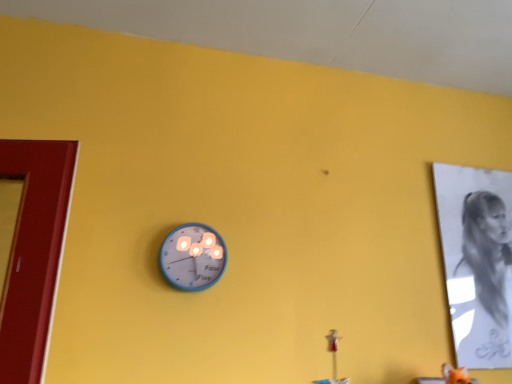
Question: Is blue metallic wall clock at center turned away from charcoal sketch of person at right?

Choices:
 (A) no
 (B) yes

Answer: (A)

Question: From a real-world perspective, does blue metallic wall clock at center stand above charcoal sketch of person at right?

Choices:
 (A) no
 (B) yes

Answer: (A)

Question: Can you confirm if blue metallic wall clock at center is smaller than charcoal sketch of person at right?

Choices:
 (A) no
 (B) yes

Answer: (B)

Question: Can you confirm if blue metallic wall clock at center is thinner than charcoal sketch of person at right?

Choices:
 (A) no
 (B) yes

Answer: (A)

Question: Does blue metallic wall clock at center come in front of charcoal sketch of person at right?

Choices:
 (A) yes
 (B) no

Answer: (A)

Question: Is charcoal sketch of person at right surrounded by blue metallic wall clock at center?

Choices:
 (A) yes
 (B) no

Answer: (B)

Question: Can you confirm if charcoal sketch of person at right is taller than blue metallic wall clock at center?

Choices:
 (A) yes
 (B) no

Answer: (A)

Question: Is charcoal sketch of person at right not within blue metallic wall clock at center?

Choices:
 (A) no
 (B) yes

Answer: (B)

Question: Is charcoal sketch of person at right wider than blue metallic wall clock at center?

Choices:
 (A) yes
 (B) no

Answer: (B)

Question: Is charcoal sketch of person at right positioned before blue metallic wall clock at center?

Choices:
 (A) yes
 (B) no

Answer: (B)

Question: Does charcoal sketch of person at right appear on the left side of blue metallic wall clock at center?

Choices:
 (A) yes
 (B) no

Answer: (B)

Question: Is charcoal sketch of person at right turned away from blue metallic wall clock at center?

Choices:
 (A) yes
 (B) no

Answer: (B)

Question: Is blue metallic wall clock at center taller or shorter than charcoal sketch of person at right?

Choices:
 (A) tall
 (B) short

Answer: (B)